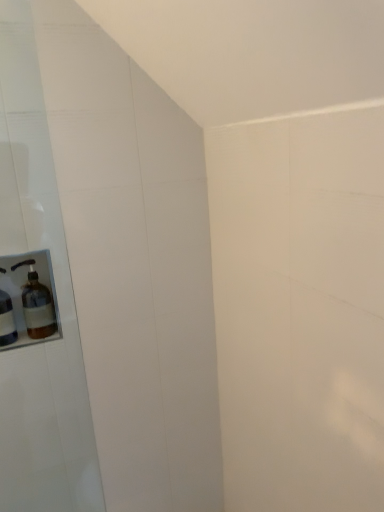
Describe the element at coordinates (37, 304) in the screenshot. I see `brown glass bottle at left, the 2th bottle positioned from the left` at that location.

Locate an element on the screen. brown glass bottle at left, which appears as the 1th bottle when viewed from the right is located at coordinates (37, 304).

Describe the element at coordinates (7, 320) in the screenshot. I see `translucent glass soap dispenser at left, the first bottle from the left` at that location.

What are the coordinates of `translucent glass soap dispenser at left, arranged as the 2th bottle when viewed from the right` in the screenshot? It's located at (7, 320).

Measure the distance between point (3, 308) and camera.

They are 4.86 feet apart.

Where is `brown glass bottle at left, which appears as the 1th bottle when viewed from the right`? Image resolution: width=384 pixels, height=512 pixels. brown glass bottle at left, which appears as the 1th bottle when viewed from the right is located at coordinates (37, 304).

Is translucent glass soap dispenser at left, the first bottle from the left, at the left side of brown glass bottle at left, which appears as the 1th bottle when viewed from the right?

Yes, translucent glass soap dispenser at left, the first bottle from the left, is to the left of brown glass bottle at left, which appears as the 1th bottle when viewed from the right.

Does translucent glass soap dispenser at left, the first bottle from the left, come behind brown glass bottle at left, the 2th bottle positioned from the left?

That is False.

Is point (1, 342) closer or farther from the camera than point (39, 331)?

Point (1, 342) is positioned closer to the camera compared to point (39, 331).

From the image's perspective, between translucent glass soap dispenser at left, arranged as the 2th bottle when viewed from the right, and brown glass bottle at left, which appears as the 1th bottle when viewed from the right, which one is located above?

brown glass bottle at left, which appears as the 1th bottle when viewed from the right, from the image's perspective.

From a real-world perspective, which is physically above, translucent glass soap dispenser at left, the first bottle from the left, or brown glass bottle at left, which appears as the 1th bottle when viewed from the right?

From a 3D spatial view, brown glass bottle at left, which appears as the 1th bottle when viewed from the right, is above.

Which object is wider, translucent glass soap dispenser at left, the first bottle from the left, or brown glass bottle at left, which appears as the 1th bottle when viewed from the right?

brown glass bottle at left, which appears as the 1th bottle when viewed from the right.

In the scene shown: Who is shorter, translucent glass soap dispenser at left, the first bottle from the left, or brown glass bottle at left, the 2th bottle positioned from the left?

Standing shorter between the two is brown glass bottle at left, the 2th bottle positioned from the left.

Looking at the image, does translucent glass soap dispenser at left, the first bottle from the left, seem bigger or smaller compared to brown glass bottle at left, the 2th bottle positioned from the left?

Clearly, translucent glass soap dispenser at left, the first bottle from the left, is smaller in size than brown glass bottle at left, the 2th bottle positioned from the left.

Is translucent glass soap dispenser at left, arranged as the 2th bottle when viewed from the right, inside the boundaries of brown glass bottle at left, which appears as the 1th bottle when viewed from the right, or outside?

translucent glass soap dispenser at left, arranged as the 2th bottle when viewed from the right, lies outside brown glass bottle at left, which appears as the 1th bottle when viewed from the right.

Would you consider translucent glass soap dispenser at left, the first bottle from the left, to be distant from brown glass bottle at left, which appears as the 1th bottle when viewed from the right?

That's not correct — translucent glass soap dispenser at left, the first bottle from the left, is a little close to brown glass bottle at left, which appears as the 1th bottle when viewed from the right.

Is translucent glass soap dispenser at left, arranged as the 2th bottle when viewed from the right, oriented towards brown glass bottle at left, which appears as the 1th bottle when viewed from the right?

No, translucent glass soap dispenser at left, arranged as the 2th bottle when viewed from the right, is not turned towards brown glass bottle at left, which appears as the 1th bottle when viewed from the right.

Could you measure the distance between translucent glass soap dispenser at left, arranged as the 2th bottle when viewed from the right, and brown glass bottle at left, which appears as the 1th bottle when viewed from the right?

translucent glass soap dispenser at left, arranged as the 2th bottle when viewed from the right, is 3.32 inches away from brown glass bottle at left, which appears as the 1th bottle when viewed from the right.

Locate an element on the screen. This screenshot has height=512, width=384. bottle below the brown glass bottle at left, the 2th bottle positioned from the left (from the image's perspective) is located at coordinates (7, 320).

Would you say brown glass bottle at left, the 2th bottle positioned from the left, is to the left or to the right of translucent glass soap dispenser at left, arranged as the 2th bottle when viewed from the right, in the picture?

brown glass bottle at left, the 2th bottle positioned from the left, is to the right of translucent glass soap dispenser at left, arranged as the 2th bottle when viewed from the right.

Is the position of brown glass bottle at left, the 2th bottle positioned from the left, more distant than that of translucent glass soap dispenser at left, arranged as the 2th bottle when viewed from the right?

Yes, it is.

Is point (49, 290) farther from camera compared to point (3, 343)?

Yes, point (49, 290) is farther from viewer.

From the image's perspective, which is below, brown glass bottle at left, which appears as the 1th bottle when viewed from the right, or translucent glass soap dispenser at left, the first bottle from the left?

From the image's view, translucent glass soap dispenser at left, the first bottle from the left, is below.

From a real-world perspective, relative to translucent glass soap dispenser at left, the first bottle from the left, is brown glass bottle at left, the 2th bottle positioned from the left, vertically above or below?

In terms of real-world spatial position, brown glass bottle at left, the 2th bottle positioned from the left, is above translucent glass soap dispenser at left, the first bottle from the left.

Between brown glass bottle at left, the 2th bottle positioned from the left, and translucent glass soap dispenser at left, the first bottle from the left, which one has larger width?

Answer: brown glass bottle at left, the 2th bottle positioned from the left.

Between brown glass bottle at left, the 2th bottle positioned from the left, and translucent glass soap dispenser at left, arranged as the 2th bottle when viewed from the right, which one has less height?

Standing shorter between the two is brown glass bottle at left, the 2th bottle positioned from the left.

Between brown glass bottle at left, the 2th bottle positioned from the left, and translucent glass soap dispenser at left, arranged as the 2th bottle when viewed from the right, which one has larger size?

brown glass bottle at left, the 2th bottle positioned from the left, is bigger.

Is translucent glass soap dispenser at left, the first bottle from the left, a part of brown glass bottle at left, which appears as the 1th bottle when viewed from the right?

Definitely not — translucent glass soap dispenser at left, the first bottle from the left, is not inside brown glass bottle at left, which appears as the 1th bottle when viewed from the right.

Is brown glass bottle at left, the 2th bottle positioned from the left, next to translucent glass soap dispenser at left, the first bottle from the left?

Indeed, brown glass bottle at left, the 2th bottle positioned from the left, and translucent glass soap dispenser at left, the first bottle from the left, are beside each other and touching.

Is brown glass bottle at left, which appears as the 1th bottle when viewed from the right, positioned with its back to translucent glass soap dispenser at left, the first bottle from the left?

No, brown glass bottle at left, which appears as the 1th bottle when viewed from the right, is not facing the opposite direction of translucent glass soap dispenser at left, the first bottle from the left.

What's the angular difference between brown glass bottle at left, the 2th bottle positioned from the left, and translucent glass soap dispenser at left, arranged as the 2th bottle when viewed from the right,'s facing directions?

0.000227 degrees.

This screenshot has height=512, width=384. In the image, there is a brown glass bottle at left, the 2th bottle positioned from the left. What are the coordinates of `bottle below it (from the image's perspective)` in the screenshot? It's located at (7, 320).

Locate an element on the screen. The image size is (384, 512). bottle located above the translucent glass soap dispenser at left, arranged as the 2th bottle when viewed from the right (from the image's perspective) is located at coordinates (37, 304).

The image size is (384, 512). Identify the location of bottle below the brown glass bottle at left, which appears as the 1th bottle when viewed from the right (from the image's perspective). (7, 320).